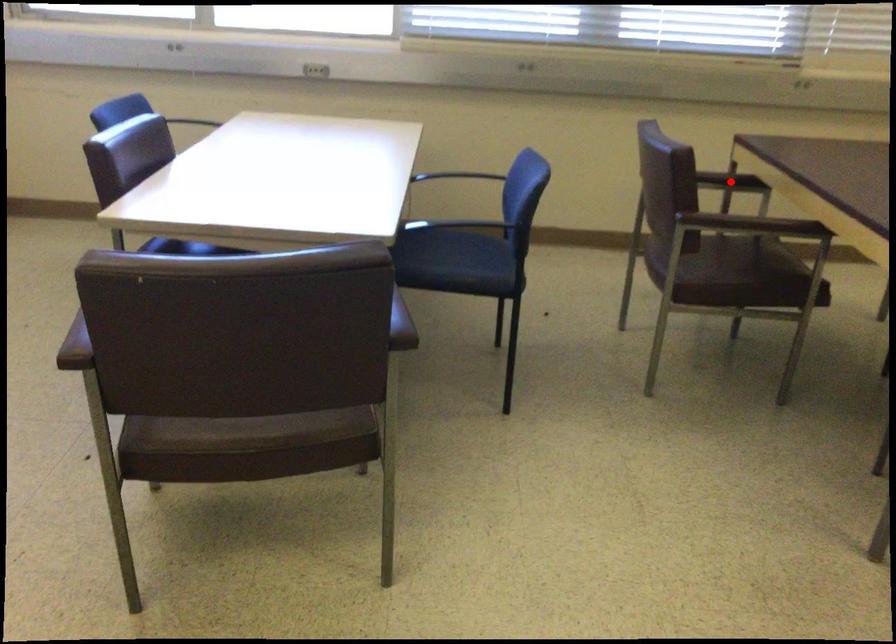
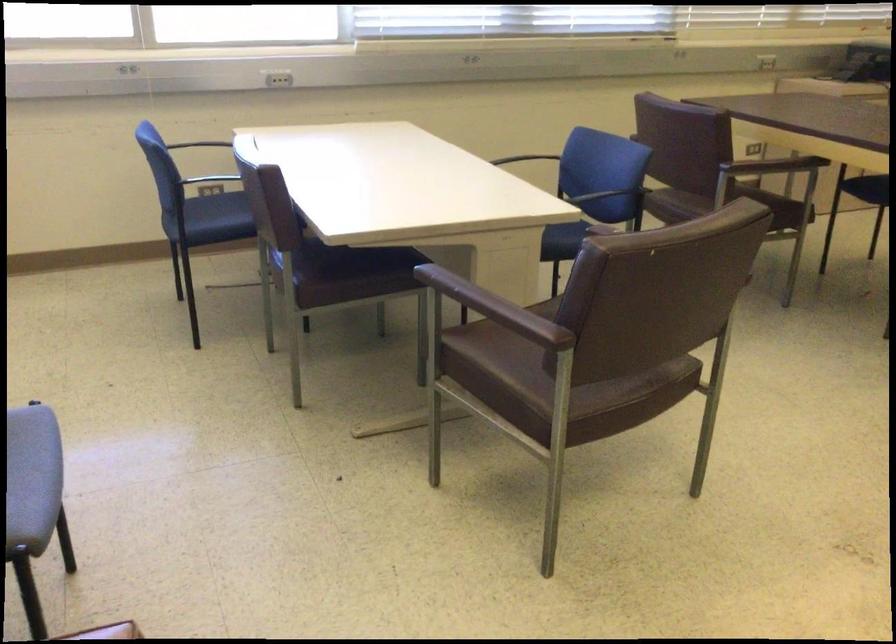
Question: I am providing you with two images of the same scene from different viewpoints. A red point is marked on the first image. At the location where the point appears in image 1, is it still visible in image 2?

Choices:
 (A) Yes
 (B) No

Answer: (B)